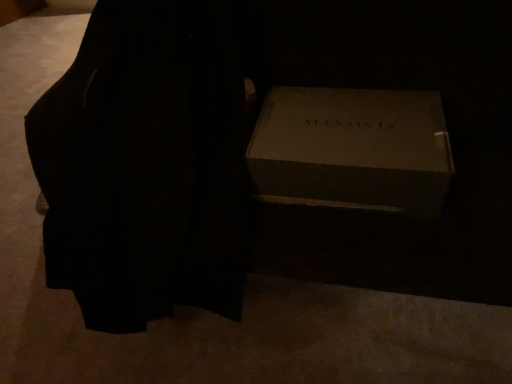
This screenshot has height=384, width=512. Identify the location of matte cardboard box at center. (352, 149).

The height and width of the screenshot is (384, 512). What do you see at coordinates (352, 149) in the screenshot?
I see `matte cardboard box at center` at bounding box center [352, 149].

Find the location of `black velvet dress at center`. black velvet dress at center is located at coordinates (146, 165).

The width and height of the screenshot is (512, 384). What do you see at coordinates (146, 165) in the screenshot? I see `black velvet dress at center` at bounding box center [146, 165].

Find the location of a particular element. This screenshot has height=384, width=512. matte cardboard box at center is located at coordinates (352, 149).

Is matte cardboard box at center at the left side of black velvet dress at center?

No.

Is matte cardboard box at center closer to the viewer compared to black velvet dress at center?

That is False.

Between point (254, 143) and point (121, 284), which one is positioned behind?

The point (121, 284) is farther.

From the image's perspective, is matte cardboard box at center above black velvet dress at center?

No, from the image's perspective, matte cardboard box at center is not over black velvet dress at center.

From a real-world perspective, between matte cardboard box at center and black velvet dress at center, who is vertically higher?

matte cardboard box at center.

In terms of width, does matte cardboard box at center look wider or thinner when compared to black velvet dress at center?

In the image, matte cardboard box at center appears to be more narrow than black velvet dress at center.

Which of these two, matte cardboard box at center or black velvet dress at center, stands shorter?

With less height is matte cardboard box at center.

Between matte cardboard box at center and black velvet dress at center, which one has smaller size?

matte cardboard box at center is smaller.

Is black velvet dress at center located within matte cardboard box at center?

Definitely not — black velvet dress at center is not inside matte cardboard box at center.

Is matte cardboard box at center directly adjacent to black velvet dress at center?

matte cardboard box at center is not next to black velvet dress at center, and they're not touching.

Is matte cardboard box at center looking in the opposite direction of black velvet dress at center?

No, matte cardboard box at center is not facing the opposite direction of black velvet dress at center.

Can you tell me how much matte cardboard box at center and black velvet dress at center differ in facing direction?

The facing directions of matte cardboard box at center and black velvet dress at center are 0.000481 degrees apart.

At what (x,y) coordinates should I click in order to perform the action: click on dress on the left of matte cardboard box at center. Please return your answer as a coordinate pair (x, y). The image size is (512, 384). Looking at the image, I should click on (146, 165).

Is black velvet dress at center at the left side of matte cardboard box at center?

Indeed, black velvet dress at center is positioned on the left side of matte cardboard box at center.

Which is behind, black velvet dress at center or matte cardboard box at center?

matte cardboard box at center is further from the camera.

Considering the points (211, 21) and (303, 173), which point is in front, point (211, 21) or point (303, 173)?

The point (303, 173) is closer.

From the image's perspective, is black velvet dress at center beneath matte cardboard box at center?

No, from the image's perspective, black velvet dress at center is not below matte cardboard box at center.

From a real-world perspective, which object rests below the other?

In real-world perspective, black velvet dress at center is lower.

Does black velvet dress at center have a lesser width compared to matte cardboard box at center?

Incorrect, the width of black velvet dress at center is not less than that of matte cardboard box at center.

Between black velvet dress at center and matte cardboard box at center, which one has more height?

black velvet dress at center.

Who is smaller, black velvet dress at center or matte cardboard box at center?

matte cardboard box at center.

Would you say black velvet dress at center is outside matte cardboard box at center?

Yes, black velvet dress at center is outside of matte cardboard box at center.

Is black velvet dress at center beside matte cardboard box at center?

black velvet dress at center and matte cardboard box at center are not in contact.

Is matte cardboard box at center at the back of black velvet dress at center?

No, black velvet dress at center's orientation is not away from matte cardboard box at center.

How different are the orientations of black velvet dress at center and matte cardboard box at center in degrees?

The angular difference between black velvet dress at center and matte cardboard box at center is 0.000481 degrees.

You are a GUI agent. You are given a task and a screenshot of the screen. Output one action in this format:
    pyautogui.click(x=<x>, y=<y>)
    Task: Click on the dress that appears on the left of matte cardboard box at center
    This screenshot has width=512, height=384.
    Given the screenshot: What is the action you would take?
    pyautogui.click(x=146, y=165)

Locate an element on the screen. The height and width of the screenshot is (384, 512). dress on the left of matte cardboard box at center is located at coordinates (146, 165).

Image resolution: width=512 pixels, height=384 pixels. What are the coordinates of `dress above the matte cardboard box at center (from the image's perspective)` in the screenshot? It's located at (146, 165).